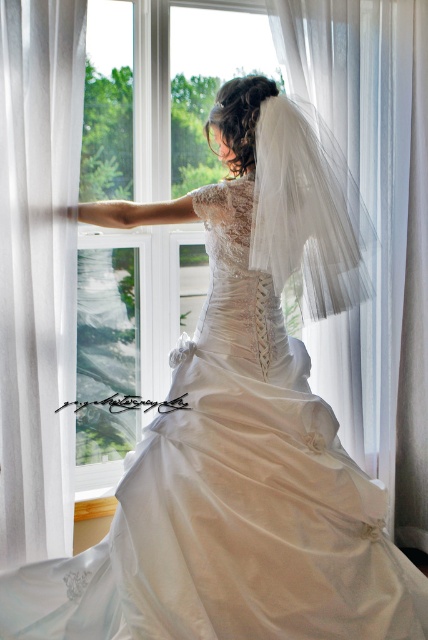
You are a photographer trying to capture the perfect shot of the bride. You notice two points marked in the image. The first point is at coordinate point (x=59, y=252) and the second is at point (x=359, y=278). Based on their positions, which point is closer to the camera?

Point (x=359, y=278) is closer to the camera because it is in front of point (x=59, y=252) according to their spatial relationship.

You are a photographer setting up for a wedding photo shoot. You notice the white sheer curtain at left and the white tulle veil at center in the scene. Which object is positioned lower in the frame?

The white sheer curtain at left is positioned lower than the white tulle veil at center.

You are a photographer setting up for a wedding photo shoot. You have a camera and want to capture the bride with both the white sheer curtain at left and the white tulle veil at center in the frame. Since you want to ensure both elements are visible, which object might you need to adjust in the composition to accommodate their widths?

The white sheer curtain at left has a lesser width compared to the white tulle veil at center, so you might need to adjust the position of the white sheer curtain at left to ensure it fits within the frame along with the wider white tulle veil at center.